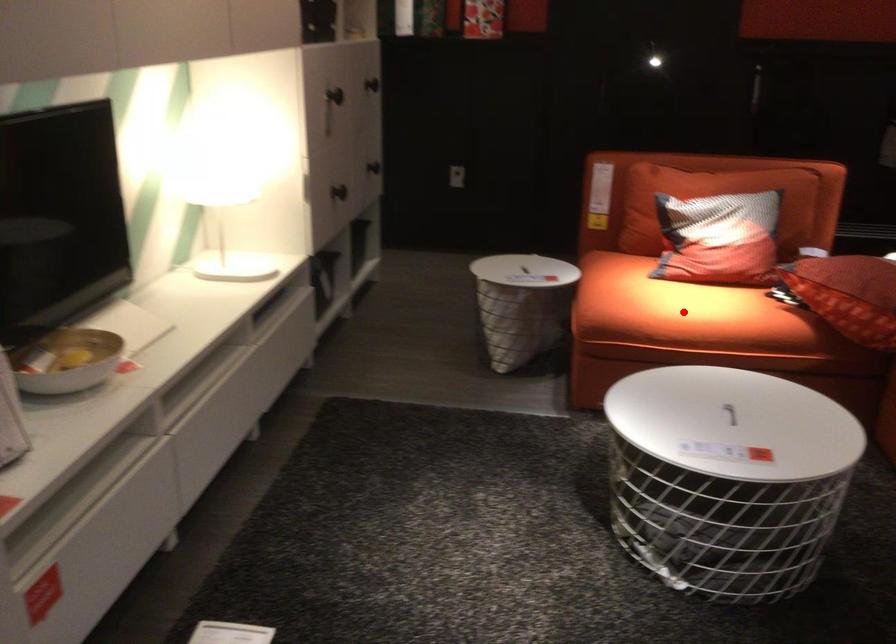
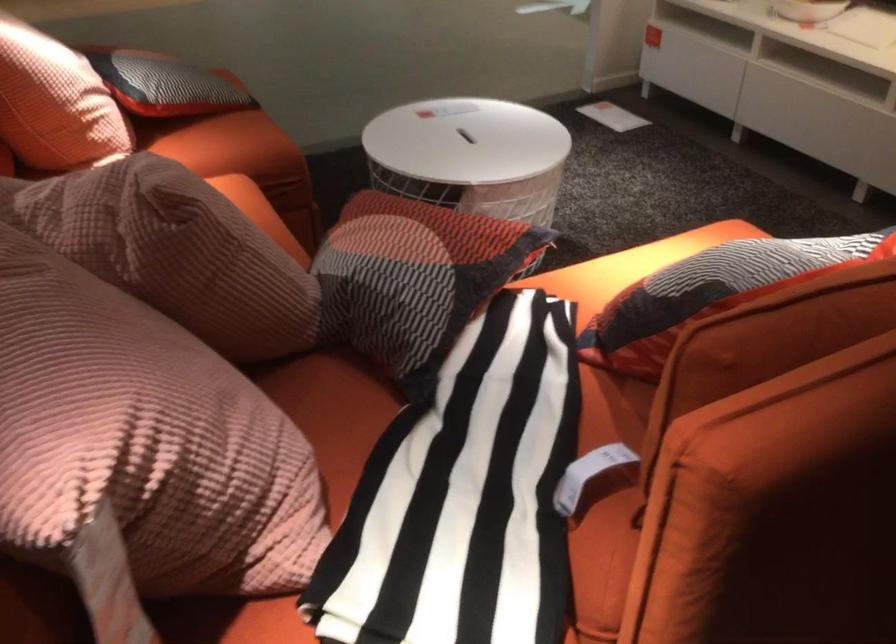
Question: I am providing you with two images of the same scene from different viewpoints. A red point is marked on the first image. Can you still see the location of the red point in image 2?

Choices:
 (A) Yes
 (B) No

Answer: (B)